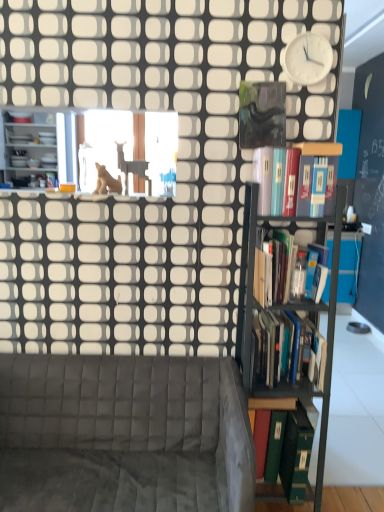
Question: Is white plastic clock at upper right aimed at hardcover books at right, positioned as the second book in bottom-to-top order?

Choices:
 (A) no
 (B) yes

Answer: (A)

Question: Can you confirm if white plastic clock at upper right is smaller than hardcover books at right, positioned as the second book in bottom-to-top order?

Choices:
 (A) no
 (B) yes

Answer: (B)

Question: From a real-world perspective, is white plastic clock at upper right on top of hardcover books at right, positioned as the second book in bottom-to-top order?

Choices:
 (A) no
 (B) yes

Answer: (B)

Question: Does white plastic clock at upper right have a greater width compared to hardcover books at right, which is the 3th book in top-to-bottom order?

Choices:
 (A) no
 (B) yes

Answer: (A)

Question: Can you confirm if white plastic clock at upper right is thinner than hardcover books at right, which is the 3th book in top-to-bottom order?

Choices:
 (A) no
 (B) yes

Answer: (B)

Question: In terms of size, does hardcover books at right, which is the 3th book in top-to-bottom order, appear bigger or smaller than matte white shelves at left?

Choices:
 (A) small
 (B) big

Answer: (A)

Question: Is point (309, 318) positioned closer to the camera than point (52, 157)?

Choices:
 (A) farther
 (B) closer

Answer: (A)

Question: From a real-world perspective, is hardcover books at right, positioned as the second book in bottom-to-top order, above or below matte white shelves at left?

Choices:
 (A) above
 (B) below

Answer: (B)

Question: Looking at their shapes, would you say hardcover books at right, which is the 3th book in top-to-bottom order, is wider or thinner than matte white shelves at left?

Choices:
 (A) thin
 (B) wide

Answer: (A)

Question: Based on their positions, is hardcover books at right, marked as the second book in a top-to-bottom arrangement, located to the left or right of hardcover book at upper right, positioned as the first book in top-to-bottom order?

Choices:
 (A) right
 (B) left

Answer: (A)

Question: Considering the positions of point (289, 257) and point (326, 183), is point (289, 257) closer or farther from the camera than point (326, 183)?

Choices:
 (A) closer
 (B) farther

Answer: (B)

Question: Looking at their shapes, would you say hardcover books at right, marked as the second book in a top-to-bottom arrangement, is wider or thinner than hardcover book at upper right, acting as the fourth book starting from the bottom?

Choices:
 (A) thin
 (B) wide

Answer: (B)

Question: In terms of height, does hardcover books at right, the 3th book when ordered from bottom to top, look taller or shorter compared to hardcover book at upper right, acting as the fourth book starting from the bottom?

Choices:
 (A) tall
 (B) short

Answer: (A)

Question: Would you say hardcover book at upper right, acting as the fourth book starting from the bottom, is to the left or to the right of velvet grey couch at lower left in the picture?

Choices:
 (A) right
 (B) left

Answer: (A)

Question: Do you think hardcover book at upper right, acting as the fourth book starting from the bottom, is within velvet grey couch at lower left, or outside of it?

Choices:
 (A) outside
 (B) inside

Answer: (A)